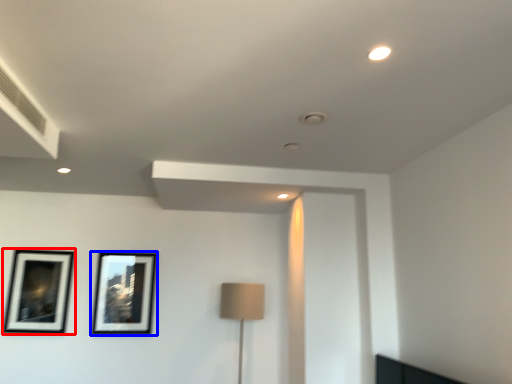
Question: Which object is closer to the camera taking this photo, picture frame (highlighted by a red box) or picture frame (highlighted by a blue box)?

Choices:
 (A) picture frame
 (B) picture frame

Answer: (A)